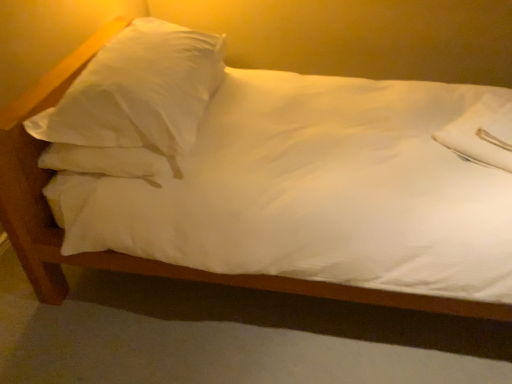
Question: From the image's perspective, is white soft pillow at upper right, which is the second pillow from left to right, positioned above or below white satin pillow at upper left, acting as the first pillow starting from the left?

Choices:
 (A) above
 (B) below

Answer: (B)

Question: Choose the correct answer: Is white soft pillow at upper right, which is the second pillow from left to right, inside white satin pillow at upper left, the 2th pillow from the right, or outside it?

Choices:
 (A) outside
 (B) inside

Answer: (A)

Question: In terms of width, does white soft pillow at upper right, which is the 1th pillow from right to left, look wider or thinner when compared to white satin pillow at upper left, acting as the first pillow starting from the left?

Choices:
 (A) thin
 (B) wide

Answer: (A)

Question: In terms of size, does white satin pillow at upper left, the 2th pillow from the right, appear bigger or smaller than white soft pillow at upper right, which is the 1th pillow from right to left?

Choices:
 (A) big
 (B) small

Answer: (A)

Question: Would you say white satin pillow at upper left, acting as the first pillow starting from the left, is inside or outside white soft pillow at upper right, which is the 1th pillow from right to left?

Choices:
 (A) outside
 (B) inside

Answer: (A)

Question: Is point (150, 129) positioned closer to the camera than point (450, 125)?

Choices:
 (A) farther
 (B) closer

Answer: (B)

Question: From a real-world perspective, relative to white soft pillow at upper right, which is the second pillow from left to right, is white satin pillow at upper left, acting as the first pillow starting from the left, vertically above or below?

Choices:
 (A) above
 (B) below

Answer: (A)